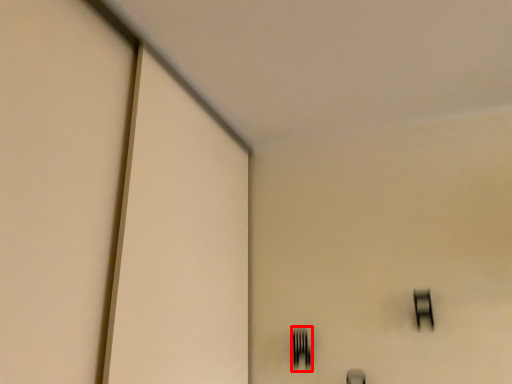
Question: From the image, what is the correct spatial relationship of fork (annotated by the red box) in relation to window?

Choices:
 (A) left
 (B) right

Answer: (A)